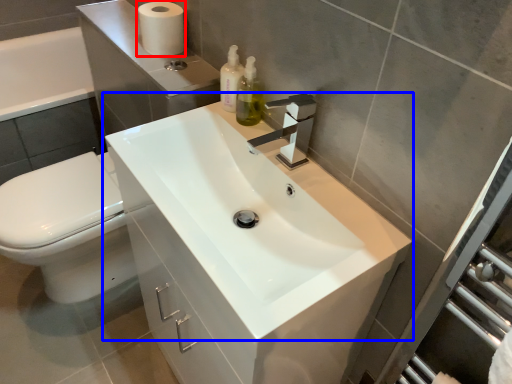
Question: Which object is further to the camera taking this photo, toilet paper (highlighted by a red box) or sink (highlighted by a blue box)?

Choices:
 (A) toilet paper
 (B) sink

Answer: (A)